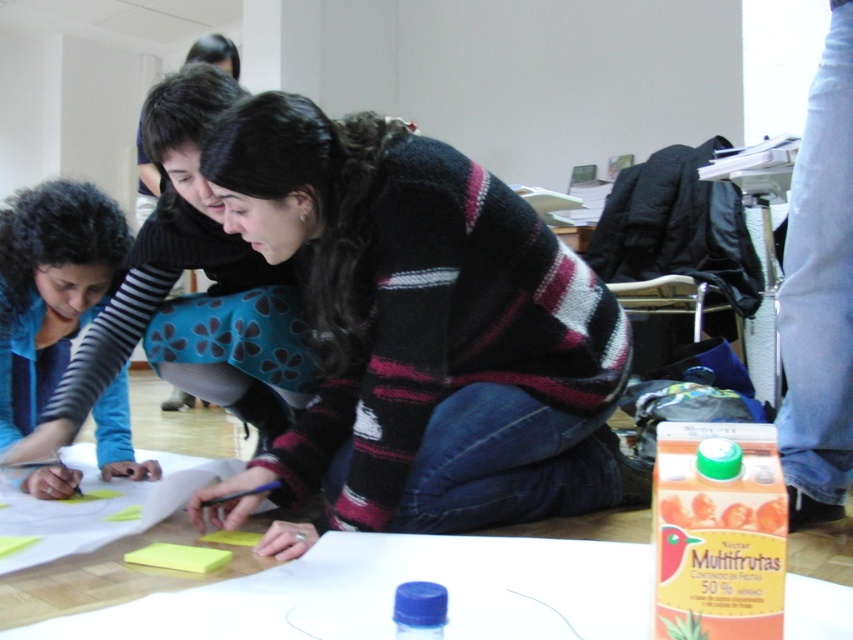
You are standing in the room and want to reach point (306, 588). If your walking speed is 1.2 m per second, how long will it take you to reach there?

The distance between you and point (306, 588) is 1.11 meters. At a speed of 1.2 m per second, it will take approximately 0.925 seconds to reach the point.

You are an observer standing at the entrance of the room. You notice two people wearing the knitted sweater at center and the blue fabric shirt at lower left. Which clothing item is wider?

The knitted sweater at center is wider than the blue fabric shirt at lower left according to the description provided.

What is located at the coordinates point (392,588) in the image?

The point (392,588) marks the location of the white paper at center.